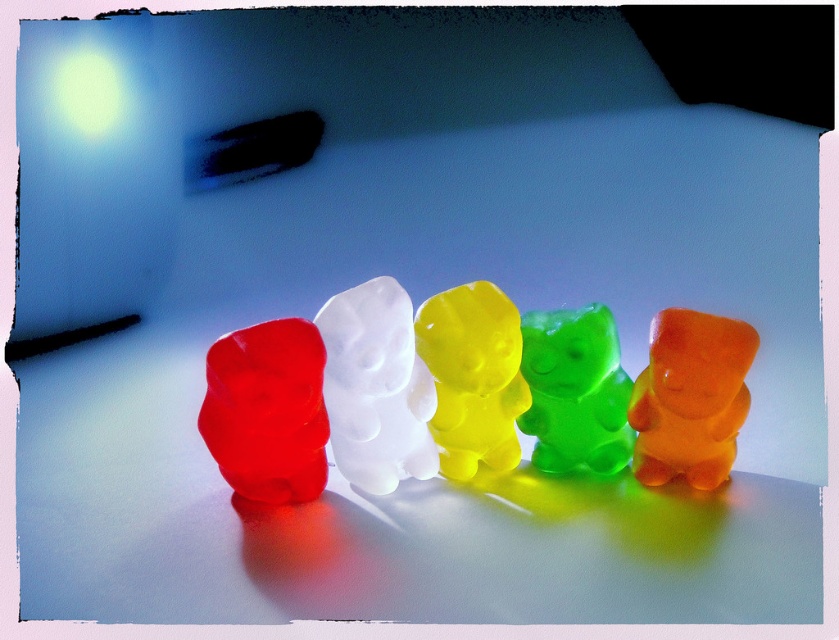
Question: Which point appears farthest from the camera in this image?

Choices:
 (A) (572, 403)
 (B) (319, 320)

Answer: (A)

Question: Which object is farther from the camera taking this photo?

Choices:
 (A) translucent gelatin bear at center
 (B) translucent green gummy bear at center
 (C) translucent yellow bear at center
 (D) matte translucent gummy bear at left

Answer: (B)

Question: Can you confirm if translucent gelatin bear at center is thinner than matte translucent gummy bear at left?

Choices:
 (A) no
 (B) yes

Answer: (A)

Question: Does matte translucent gummy bear at left appear under translucent green gummy bear at center?

Choices:
 (A) yes
 (B) no

Answer: (A)

Question: Can you confirm if translucent gelatin bear at center is wider than translucent green gummy bear at center?

Choices:
 (A) no
 (B) yes

Answer: (B)

Question: Which object is farther from the camera taking this photo?

Choices:
 (A) translucent white bear at center
 (B) translucent green gummy bear at center
 (C) matte translucent gummy bear at left

Answer: (B)